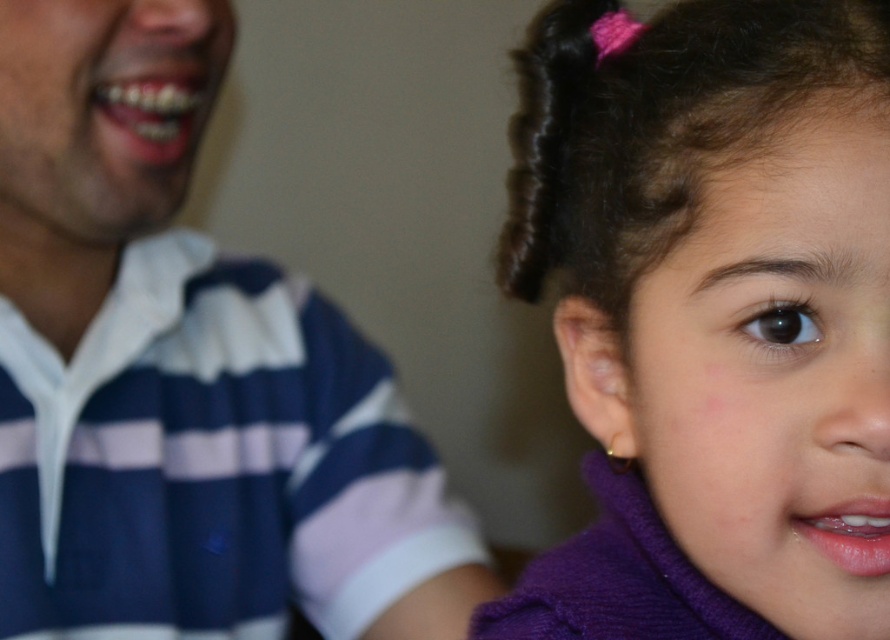
You are a tailor measuring the distance between two garments for a display. The purple fuzzy sweater at right and the striped cotton shirt at left are hanging on a rack. Can a 18 inch wide mannequin fit between them without touching either garment?

The distance between the purple fuzzy sweater at right and the striped cotton shirt at left is 17.95 inches, which is slightly less than the mannequin width of 18 inches. Therefore, the mannequin cannot fit between them without touching the garments.

From the picture: You are a fashion designer observing the image. You need to determine which clothing item is smaller in size between the purple fuzzy sweater at right and the striped cotton shirt at left. Which one is it?

The purple fuzzy sweater at right has a smaller size compared to the striped cotton shirt at left, so the purple fuzzy sweater at right is the smaller one.

You are a photographer adjusting the lighting for a portrait. You need to ensure that the striped cotton shirt at left and the dark brown curly hair at upper right are both well lit. Given their distance apart, do you think you can use a single light source positioned centrally between them to evenly illuminate both subjects?

The striped cotton shirt at left is 46.35 centimeters from dark brown curly hair at upper right. A single light source placed centrally between them could potentially provide even illumination, but the effectiveness depends on the light source size and diffusion. For best results, using a softbox or reflector might help balance the lighting between both subjects.